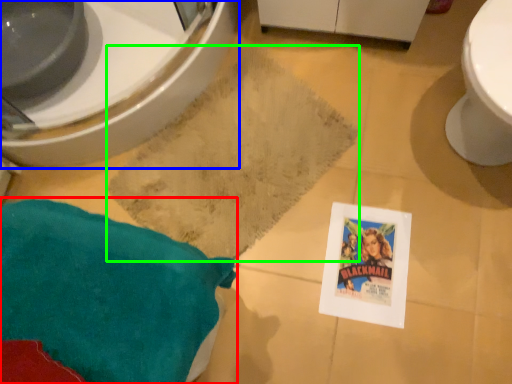
Question: Considering the real-world distances, which object is closest to throw pillow (highlighted by a red box)? bidet (highlighted by a blue box) or bath mat (highlighted by a green box).

Choices:
 (A) bidet
 (B) bath mat

Answer: (B)